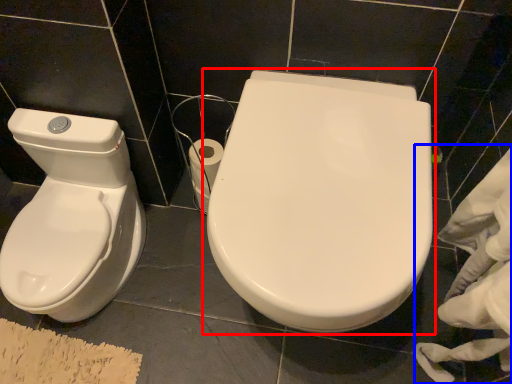
Question: Among these objects, which one is farthest to the camera, toilet (highlighted by a red box) or material (highlighted by a blue box)?

Choices:
 (A) toilet
 (B) material

Answer: (A)